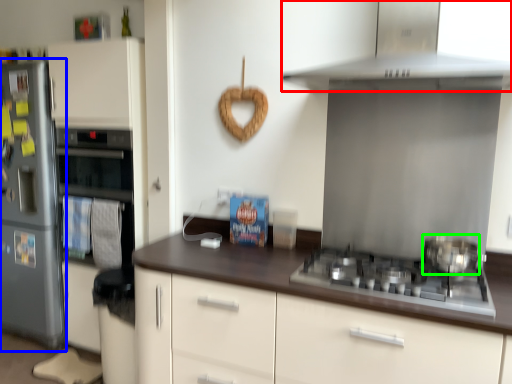
Question: Estimate the real-world distances between objects in this image. Which object is closer to home appliance (highlighted by a red box), refrigerator (highlighted by a blue box) or kitchen appliance (highlighted by a green box)?

Choices:
 (A) refrigerator
 (B) kitchen appliance

Answer: (B)